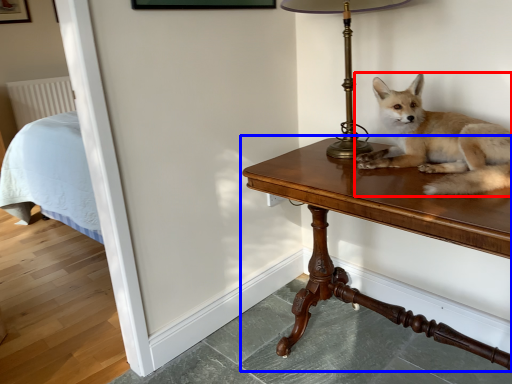
Question: Which point is further to the camera, dog (highlighted by a red box) or table (highlighted by a blue box)?

Choices:
 (A) dog
 (B) table

Answer: (A)